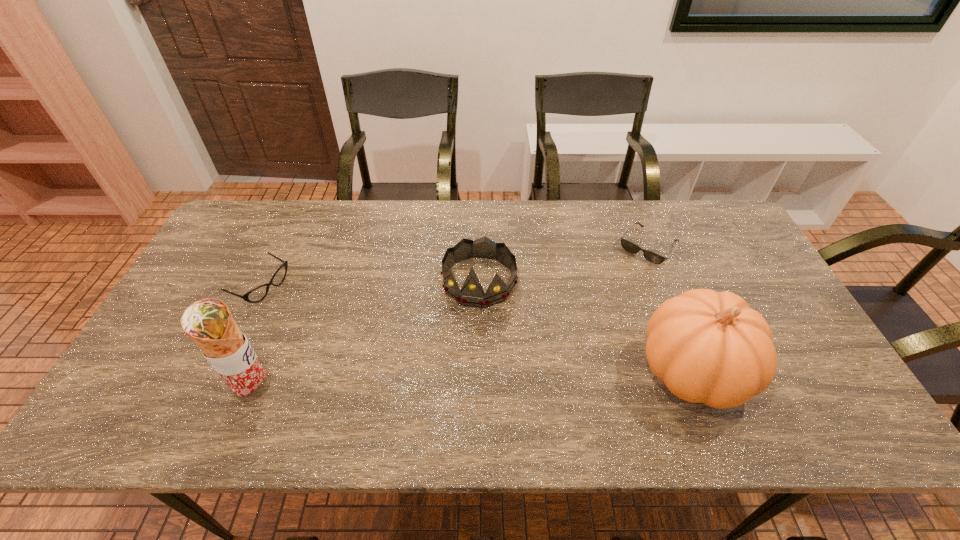
Image resolution: width=960 pixels, height=540 pixels. I want to click on vacant region between the burrito and the pumpkin, so click(x=473, y=379).

Where is `blank region between the sunglasses and the burrito`? blank region between the sunglasses and the burrito is located at coordinates (451, 318).

Locate an element on the screen. free spot between the shortest object and the fourth tallest object is located at coordinates (455, 267).

This screenshot has width=960, height=540. I want to click on vacant space that's between the sunglasses and the third tallest object, so click(x=564, y=264).

What are the coordinates of `vacant space in between the pumpkin and the burrito` in the screenshot? It's located at (473, 379).

Identify the location of free space between the burrito and the tiara. (367, 334).

Locate an element on the screen. unoccupied area between the second shortest object and the burrito is located at coordinates (258, 337).

Identify the location of object identified as the second closest to the second shortest object. (472, 294).

Image resolution: width=960 pixels, height=540 pixels. What are the coordinates of `the closest object relative to the tiara` in the screenshot? It's located at (709, 347).

Locate an element on the screen. This screenshot has width=960, height=540. vacant space that satisfies the following two spatial constraints: 1. on the front side of the second shortest object; 2. on the right side of the burrito is located at coordinates (214, 388).